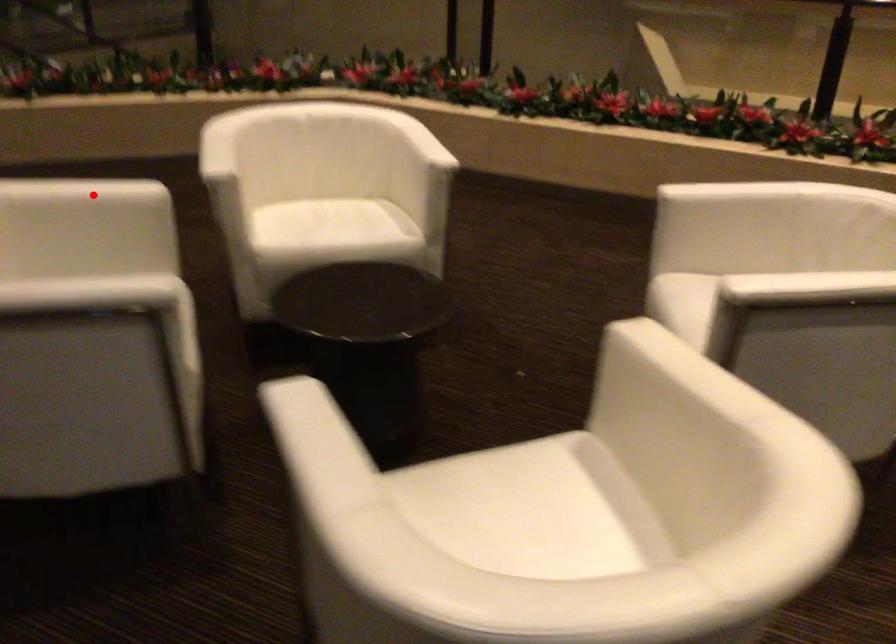
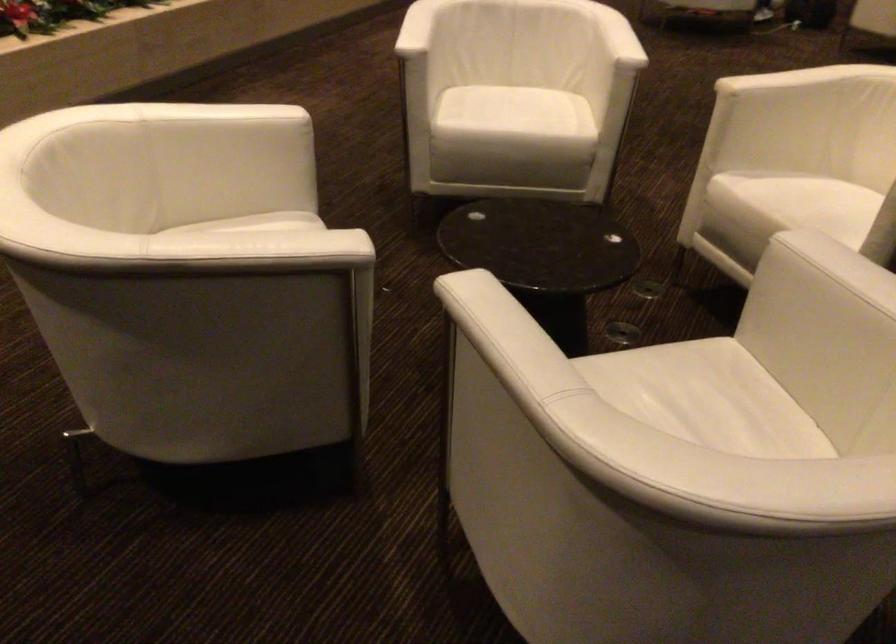
Locate, in the second image, the point that corresponds to the highlighted location in the first image.

(494, 322)